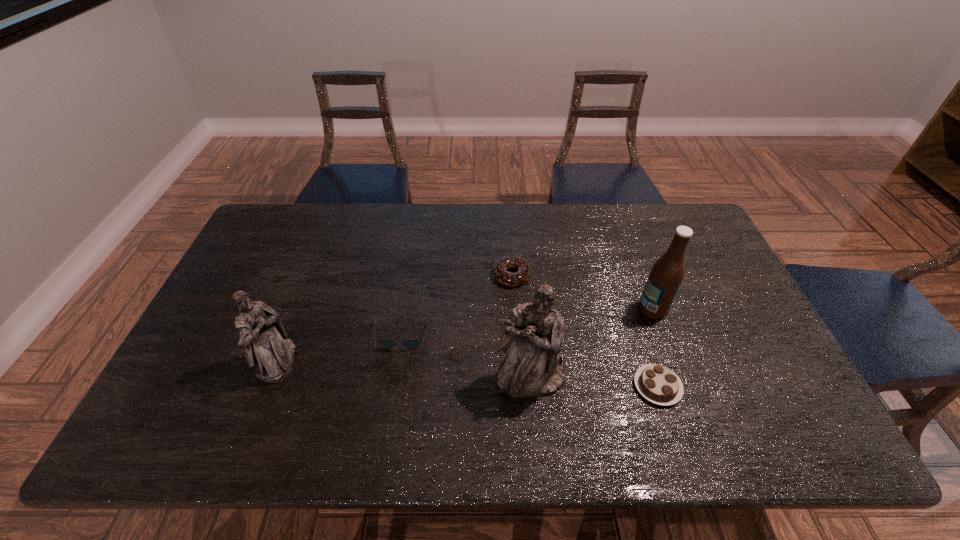
Where is `free space located 0.160m on the front of the farthest object`? The image size is (960, 540). free space located 0.160m on the front of the farthest object is located at coordinates (516, 332).

At what (x,y) coordinates should I click in order to perform the action: click on vacant space located 0.200m on the left of the chocolate cake. Please return your answer as a coordinate pair (x, y). Looking at the image, I should click on (553, 386).

This screenshot has height=540, width=960. Find the location of `chocolate cake positioned at the near edge`. chocolate cake positioned at the near edge is located at coordinates (658, 384).

Identify the location of vacant region at the far edge of the desktop. Image resolution: width=960 pixels, height=540 pixels. (438, 247).

Identify the location of vacant space at the near edge. (612, 406).

In the image, there is a desktop. At what (x,y) coordinates should I click in order to perform the action: click on vacant space at the left edge. Please return your answer as a coordinate pair (x, y). Looking at the image, I should click on (261, 293).

I want to click on vacant region at the right edge of the desktop, so click(752, 328).

Identify the location of free space between the chocolate cake and the farthest object. This screenshot has height=540, width=960. (585, 331).

Locate an element on the screen. The height and width of the screenshot is (540, 960). vacant area between the farthest object and the beer bottle is located at coordinates (583, 292).

Locate an element on the screen. The height and width of the screenshot is (540, 960). free space between the chocolate cake and the taller figurine is located at coordinates (593, 382).